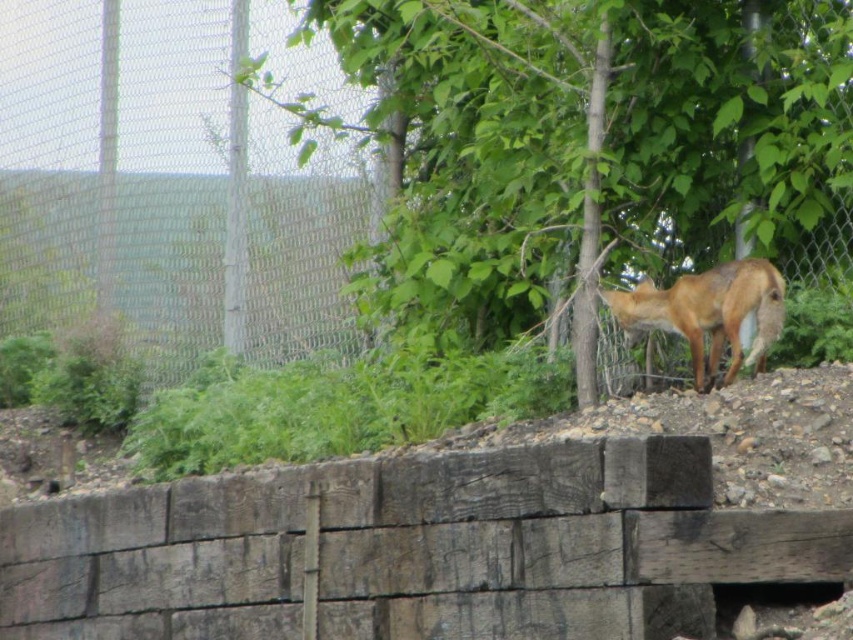
Question: Can you confirm if green leafy tree at right is thinner than brown fur fox at center?

Choices:
 (A) yes
 (B) no

Answer: (B)

Question: Is the position of green leafy tree at right less distant than that of brown fur fox at center?

Choices:
 (A) yes
 (B) no

Answer: (B)

Question: Among these objects, which one is farthest from the camera?

Choices:
 (A) brown fur fox at center
 (B) green leafy tree at right

Answer: (B)

Question: Does green leafy tree at right lie in front of brown fur fox at center?

Choices:
 (A) yes
 (B) no

Answer: (B)

Question: Among these points, which one is farthest from the camera?

Choices:
 (A) (445, 241)
 (B) (675, 321)

Answer: (A)